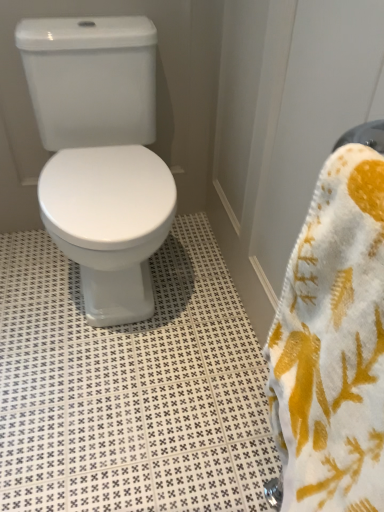
Identify the location of vacant space to the right of white glossy toilet at center. (203, 297).